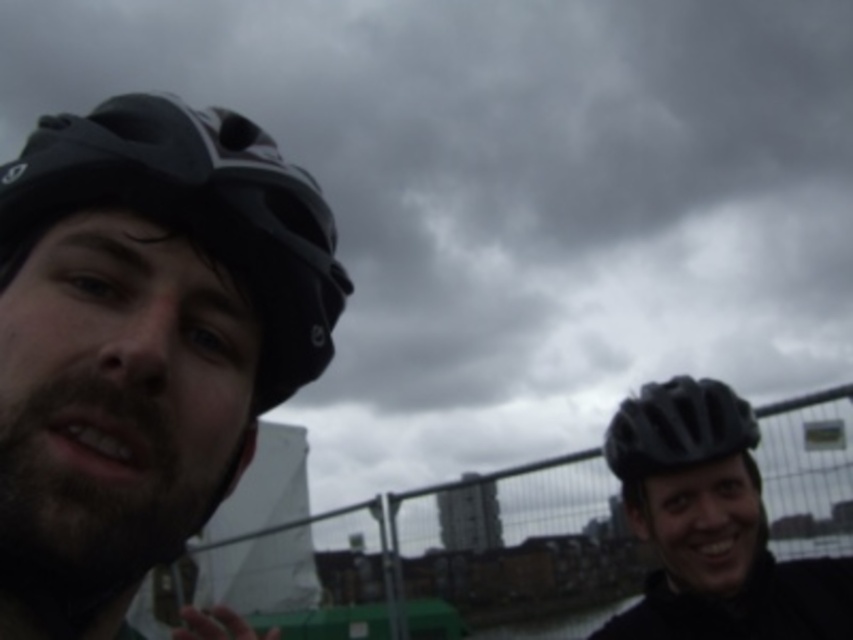
You are standing in the scene and want to walk towards the point that is closer to you. Which point should you walk towards, point (714, 397) or point (747, 428)?

You should walk towards point (714, 397) because it is in front of point (747, 428), making it closer to you.

You are a photographer trying to capture both the matte black helmet at center and the matte black helmet at right in a single shot. Based on their sizes in the image, which helmet should you focus on to ensure both are clearly visible in the frame?

The matte black helmet at center is bigger than the matte black helmet at right. To ensure both are clearly visible, focus on the matte black helmet at center as it is closer and larger, allowing the smaller one at the right to still fit within the frame.